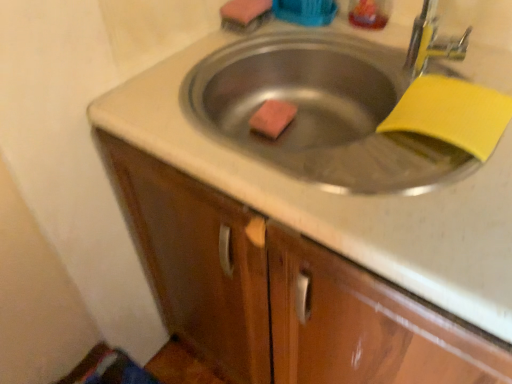
Where is `vacant area to the right of pink sponge at upper center, the second soap positioned from the bottom`? This screenshot has height=384, width=512. vacant area to the right of pink sponge at upper center, the second soap positioned from the bottom is located at coordinates (314, 30).